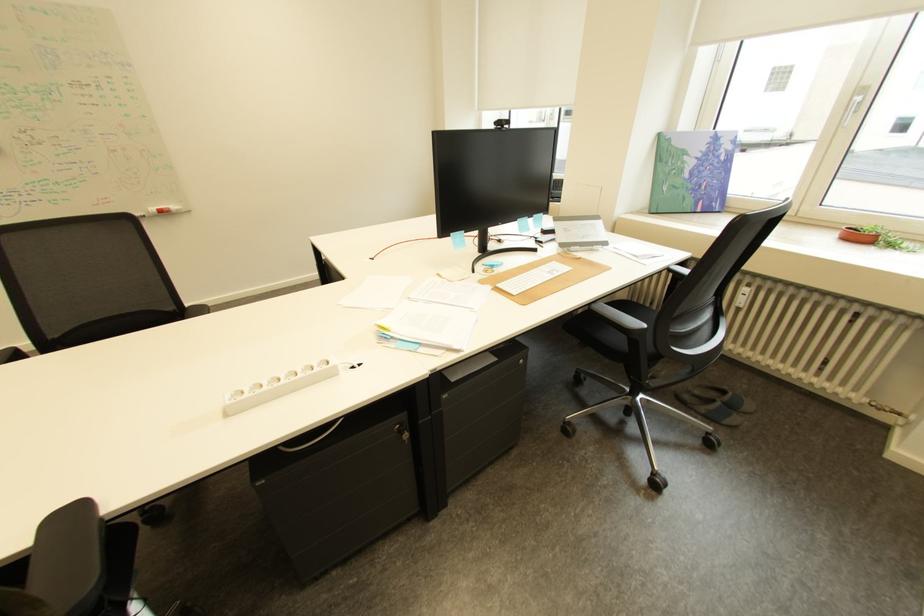
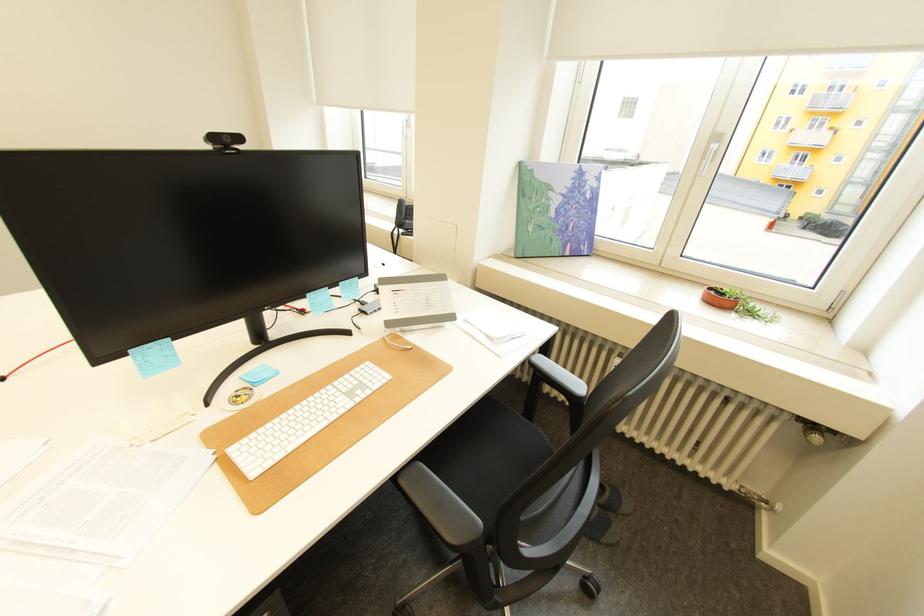
Question: The camera is either moving clockwise (left) or counter-clockwise (right) around the object. The first image is from the beginning of the video and the second image is from the end. Is the camera moving left or right when shooting the video?

Choices:
 (A) Left
 (B) Right

Answer: (A)